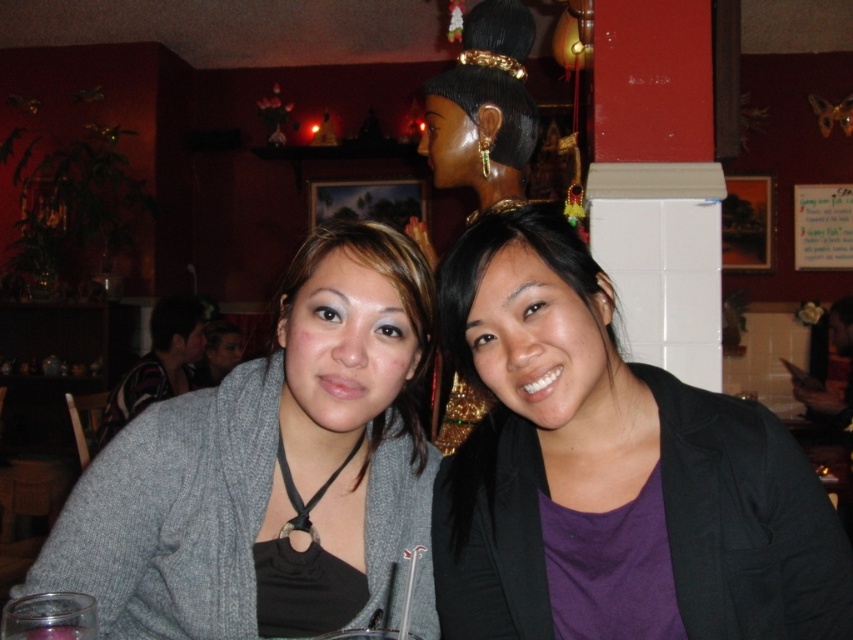
Measure the distance from purple matte/black blazer at center to matte gray cardigan at center.

purple matte/black blazer at center is 19.72 centimeters away from matte gray cardigan at center.

Who is lower down, purple matte/black blazer at center or matte gray cardigan at center?

matte gray cardigan at center

Is point (611, 456) behind point (316, 486)?

No, (611, 456) is closer to viewer.

I want to click on purple matte/black blazer at center, so click(611, 472).